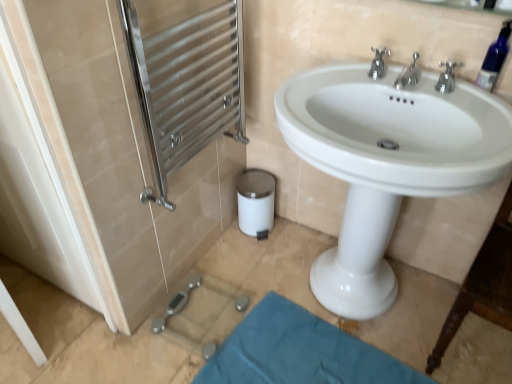
Question: From the image's perspective, relative to white glossy screen door at left, the 2th screen door when ordered from right to left, is transparent plastic bottle at upper right above or below?

Choices:
 (A) above
 (B) below

Answer: (A)

Question: Relative to white glossy screen door at left, which ranks as the first screen door in left-to-right order, is transparent plastic bottle at upper right in front or behind?

Choices:
 (A) front
 (B) behind

Answer: (B)

Question: Considering the real-world distances, which object is closest to the teal fabric bath mat at lower center?

Choices:
 (A) transparent plastic bottle at upper right
 (B) polished chrome faucet at upper center, which appears as the 2th tap when viewed from the right
 (C) white glossy sink at center
 (D) silver metallic faucet at upper right, the 1th tap from the right
 (E) white glossy screen door at left, which ranks as the first screen door in left-to-right order

Answer: (C)

Question: Which is farther from the silver metallic faucet at upper right, which is the third tap in left-to-right order?

Choices:
 (A) white glossy screen door at left, the 2th screen door when ordered from right to left
 (B) polished chrome faucet at upper center, the third tap when ordered from right to left
 (C) white glossy sink at center
 (D) polished stainless steel towel rack at left, the 2th screen door in the left-to-right sequence
 (E) transparent plastic bottle at upper right

Answer: (A)